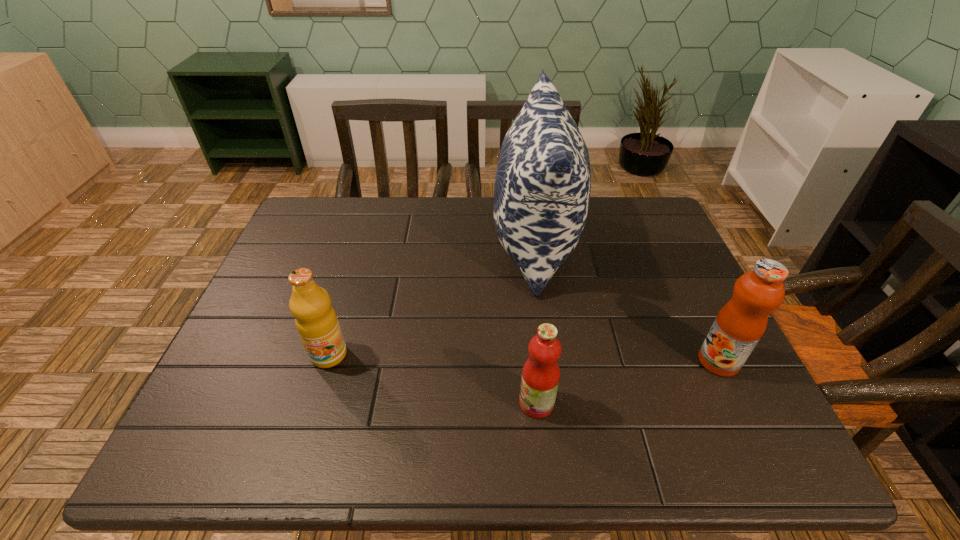
At what (x,y) coordinates should I click in order to perform the action: click on free location at the left edge. Please return your answer as a coordinate pair (x, y). Looking at the image, I should click on click(x=270, y=306).

The height and width of the screenshot is (540, 960). In the image, there is a desktop. What are the coordinates of `vacant space at the right edge` in the screenshot? It's located at (641, 257).

Locate an element on the screen. The image size is (960, 540). vacant space at the far left corner of the desktop is located at coordinates (315, 200).

The height and width of the screenshot is (540, 960). Find the location of `free space at the near left corner of the desktop`. free space at the near left corner of the desktop is located at coordinates (212, 443).

I want to click on free spot at the far right corner of the desktop, so click(x=615, y=214).

Identify the location of free space between the rightmost object and the nearest object. (628, 382).

Locate an element on the screen. free space that is in between the leftmost object and the rightmost fruit juice is located at coordinates (523, 358).

I want to click on free space that is in between the second fruit juice from left to right and the rightmost object, so (x=628, y=382).

Locate an element on the screen. This screenshot has width=960, height=540. free space between the rightmost object and the cushion is located at coordinates (626, 303).

The width and height of the screenshot is (960, 540). I want to click on free space between the nearest object and the rightmost fruit juice, so [628, 382].